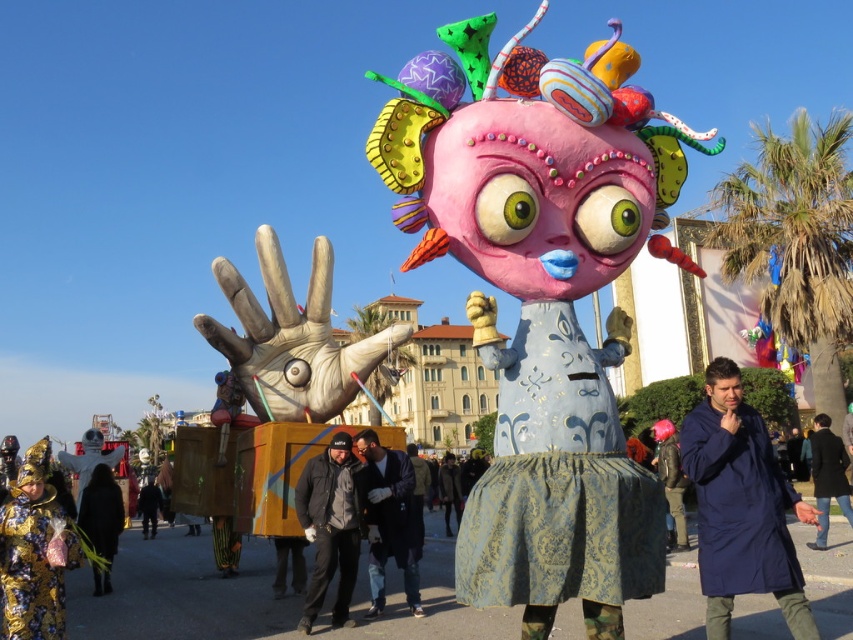
Question: Which object is positioned closest to the matte pink fabric at center?

Choices:
 (A) dark blue jacket at center
 (B) blue fabric coat at center
 (C) pink fabric umbrella at upper center

Answer: (B)

Question: Estimate the real-world distances between objects in this image. Which object is closer to the black fabric coat at lower right?

Choices:
 (A) matte pink fabric at center
 (B) gold metallic mask at lower left
 (C) pink fabric umbrella at upper center
 (D) black fabric at lower left

Answer: (C)

Question: Can you confirm if gold metallic mask at lower left is wider than black fabric jacket at center?

Choices:
 (A) yes
 (B) no

Answer: (A)

Question: Is the position of pink fabric umbrella at upper center more distant than that of black fabric at center?

Choices:
 (A) no
 (B) yes

Answer: (A)

Question: Does gold metallic mask at lower left have a smaller size compared to pink fabric umbrella at upper center?

Choices:
 (A) no
 (B) yes

Answer: (A)

Question: Among these objects, which one is farthest from the camera?

Choices:
 (A) gold metallic mask at lower left
 (B) dark blue jacket at center
 (C) blue fabric coat at center
 (D) pink fabric umbrella at upper center

Answer: (D)